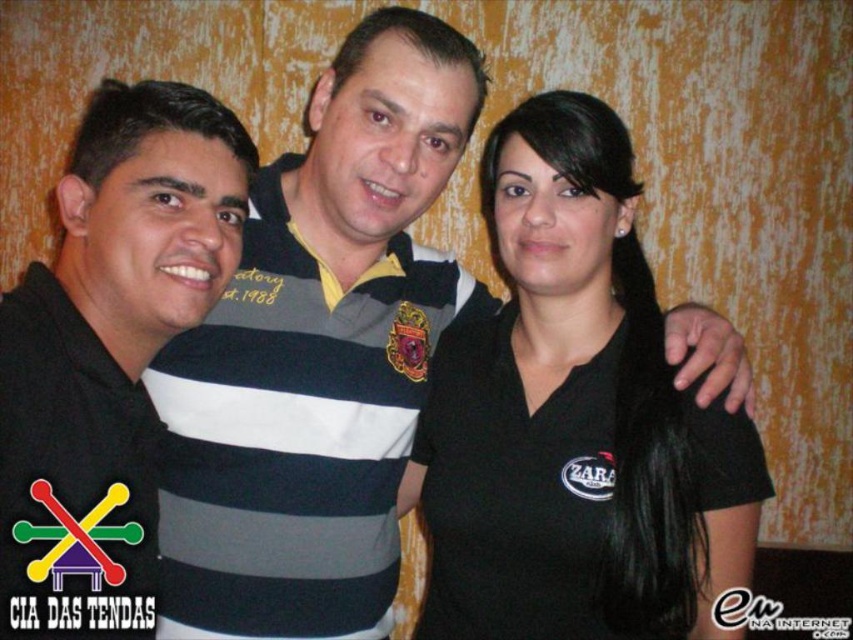
Consider the image. Does black matte shirt at center have a lesser width compared to striped cotton polo shirt at center?

Yes, black matte shirt at center is thinner than striped cotton polo shirt at center.

Which is above, black matte shirt at center or striped cotton polo shirt at center?

black matte shirt at center is higher up.

This screenshot has width=853, height=640. I want to click on black matte shirt at center, so click(572, 416).

Between black matte shirt at center and black striped polo shirt at center, which one has more height?

black matte shirt at center

The width and height of the screenshot is (853, 640). What do you see at coordinates (572, 416) in the screenshot?
I see `black matte shirt at center` at bounding box center [572, 416].

The image size is (853, 640). What are the coordinates of `black matte shirt at center` in the screenshot? It's located at (572, 416).

Is striped cotton polo shirt at center bigger than black striped polo shirt at center?

Yes.

Can you confirm if striped cotton polo shirt at center is shorter than black striped polo shirt at center?

No, striped cotton polo shirt at center is not shorter than black striped polo shirt at center.

Locate an element on the screen. The width and height of the screenshot is (853, 640). striped cotton polo shirt at center is located at coordinates (294, 433).

Locate an element on the screen. striped cotton polo shirt at center is located at coordinates (294, 433).